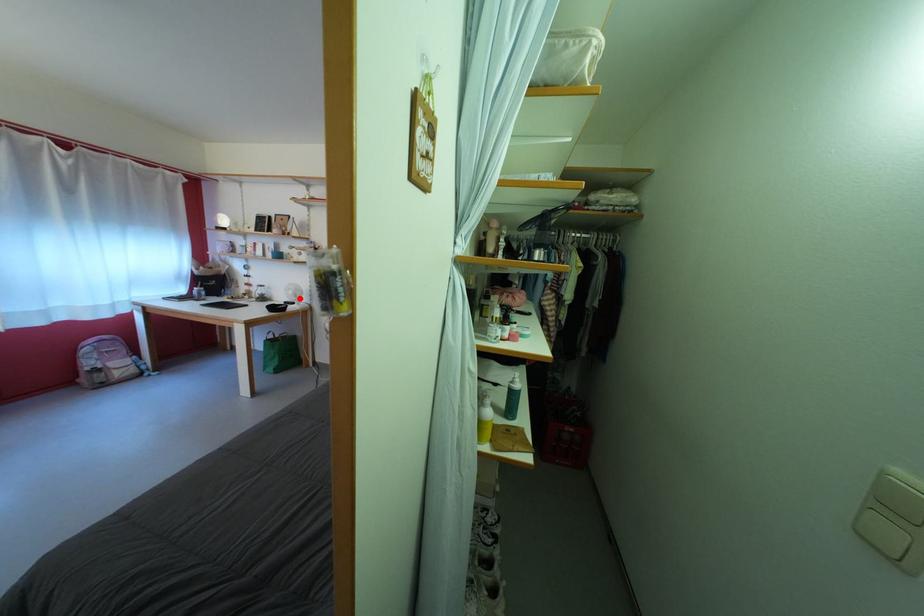
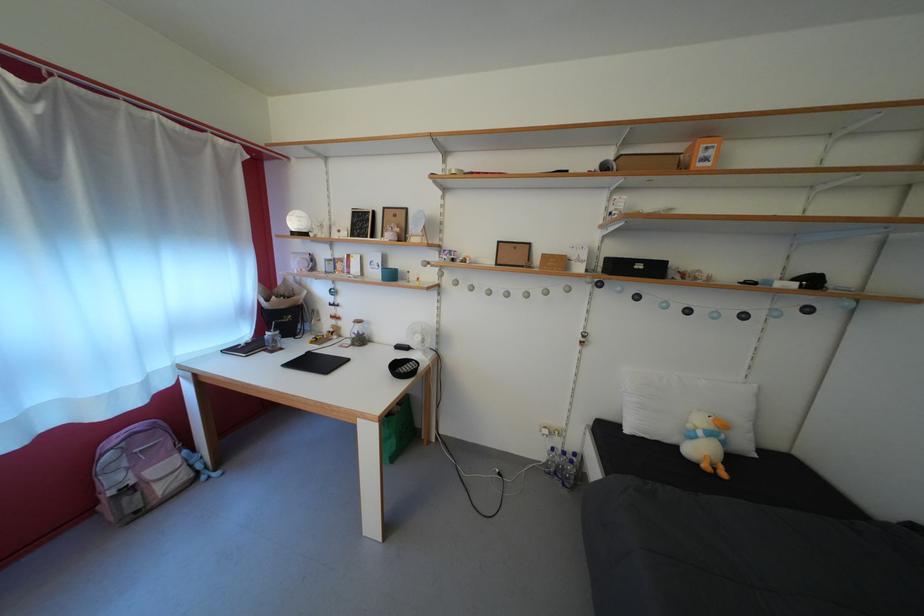
Question: I am providing you with two images of the same scene from different viewpoints. Given a red point in image1, look at the same physical point in image2. Is it:

Choices:
 (A) Closer to the viewpoint
 (B) Farther from the viewpoint

Answer: (A)